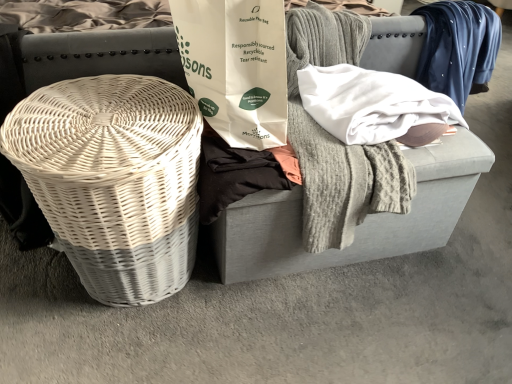
Locate an element on the screen. Image resolution: width=512 pixels, height=384 pixels. free space on the front side of gray fabric footrest at center is located at coordinates (323, 338).